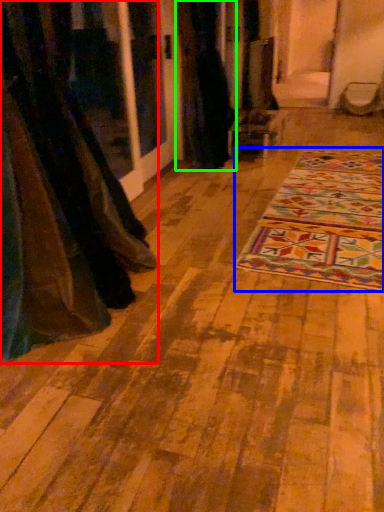
Question: Estimate the real-world distances between objects in this image. Which object is closer to curtain (highlighted by a red box), mat (highlighted by a blue box) or curtain (highlighted by a green box)?

Choices:
 (A) mat
 (B) curtain

Answer: (A)